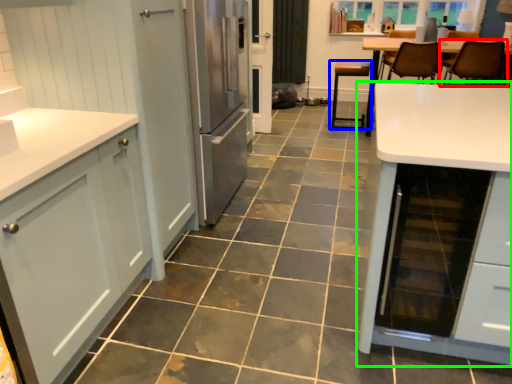
Question: Based on their relative distances, which object is nearer to chair (highlighted by a red box)? Choose from chair (highlighted by a blue box) and table (highlighted by a green box).

Choices:
 (A) chair
 (B) table

Answer: (A)